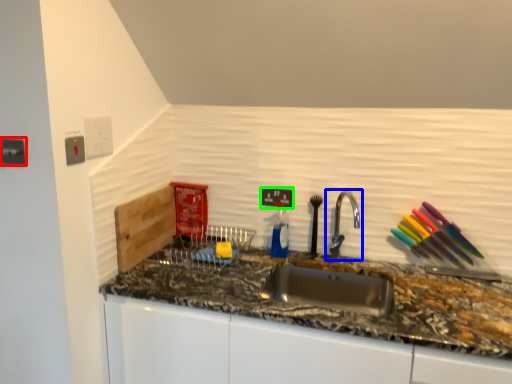
Question: Considering the real-world distances, which object is farthest from electric outlet (highlighted by a red box)? tap (highlighted by a blue box) or electric outlet (highlighted by a green box)?

Choices:
 (A) tap
 (B) electric outlet

Answer: (A)